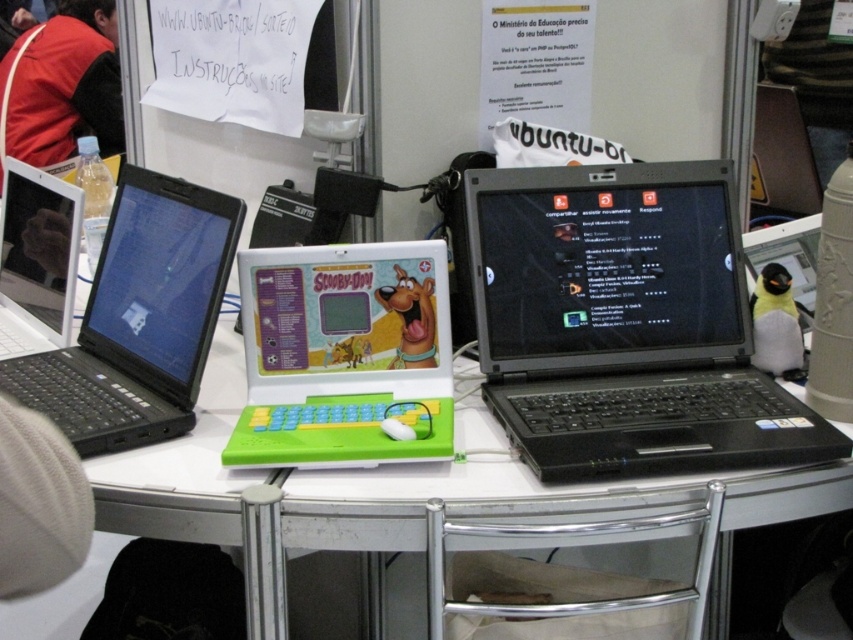
Question: Does white plastic table at center appear on the right side of green plastic laptop at center?

Choices:
 (A) no
 (B) yes

Answer: (B)

Question: Which point is farther to the camera?

Choices:
 (A) (13, 344)
 (B) (149, 237)

Answer: (A)

Question: Based on their relative distances, which object is nearer to the white plastic table at center?

Choices:
 (A) black plastic laptop at left
 (B) white plastic laptop at left
 (C) black plastic laptop at center
 (D) green plastic laptop at center

Answer: (D)

Question: Can you confirm if green plastic laptop at center is thinner than white plastic laptop at left?

Choices:
 (A) no
 (B) yes

Answer: (A)

Question: Which point is farther to the camera?

Choices:
 (A) black plastic laptop at left
 (B) white plastic table at center
 (C) black plastic laptop at center

Answer: (A)

Question: Where is black plastic laptop at center located in relation to white plastic table at center in the image?

Choices:
 (A) right
 (B) left

Answer: (A)